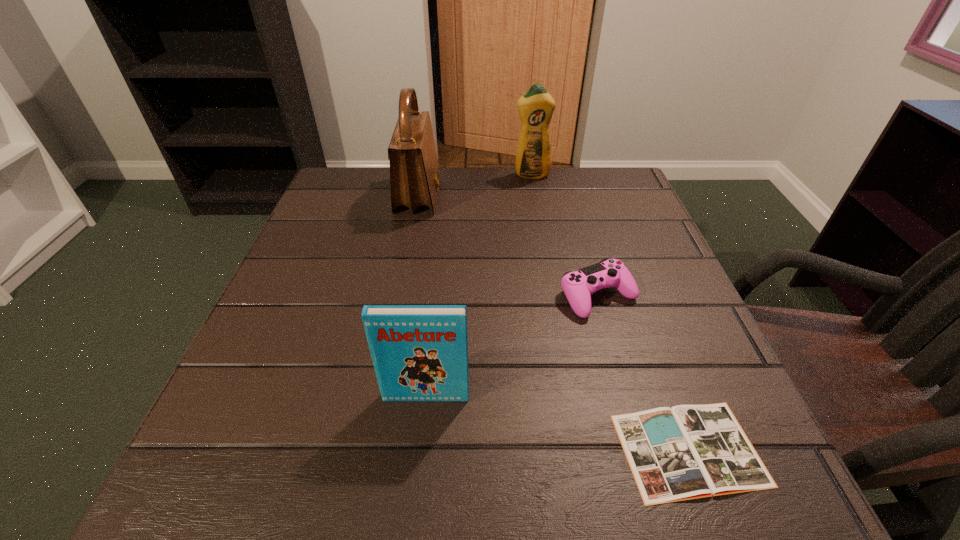
Find the location of a particular element. vacant point that satisfies the following two spatial constraints: 1. on the front cover of the taller book; 2. on the left side of the shorter book is located at coordinates (420, 450).

Find the location of a particular element. The width and height of the screenshot is (960, 540). vacant point that satisfies the following two spatial constraints: 1. on the front flap of the shoulder bag; 2. on the back side of the shortest object is located at coordinates (369, 450).

You are a GUI agent. You are given a task and a screenshot of the screen. Output one action in this format:
    pyautogui.click(x=<x>, y=<y>)
    Task: Click on the vacant space that satisfies the following two spatial constraints: 1. on the front flap of the shoulder bag; 2. on the right side of the control
    Image resolution: width=960 pixels, height=540 pixels.
    Given the screenshot: What is the action you would take?
    pyautogui.click(x=398, y=296)

Where is `free spot that satisfies the following two spatial constraints: 1. on the front cover of the taller book; 2. on the left side of the nearer book`? This screenshot has height=540, width=960. free spot that satisfies the following two spatial constraints: 1. on the front cover of the taller book; 2. on the left side of the nearer book is located at coordinates coord(420,450).